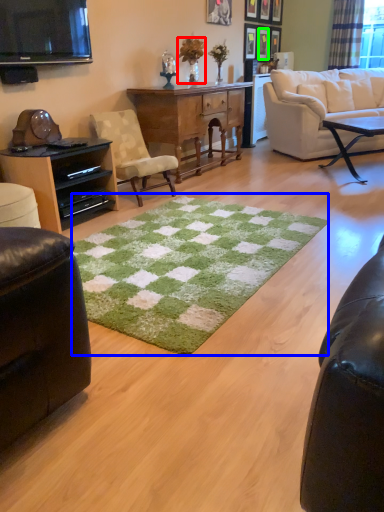
Question: Which object is the farthest from houseplant (highlighted by a red box)? Choose among these: mat (highlighted by a blue box) or picture frame (highlighted by a green box).

Choices:
 (A) mat
 (B) picture frame

Answer: (A)